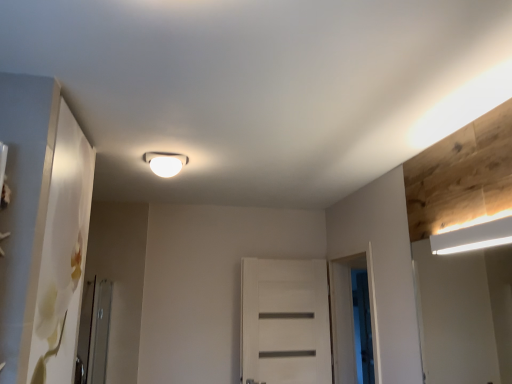
Question: Is clear glass screen door at lower left, the first screen door positioned from the front, spatially inside white matte rectangular light fixture at upper right, positioned as the second lamp in back-to-front order, or outside of it?

Choices:
 (A) inside
 (B) outside

Answer: (B)

Question: Is clear glass screen door at lower left, placed as the first screen door when sorted from left to right, taller or shorter than white matte rectangular light fixture at upper right, which appears as the second lamp when viewed from the left?

Choices:
 (A) short
 (B) tall

Answer: (B)

Question: Which is farther from the clear glass screen door at lower left, placed as the first screen door when sorted from left to right?

Choices:
 (A) white glossy light fixture at center, which appears as the 2th lamp when viewed from the right
 (B) transparent glass screen door at center-right, the third screen door viewed from the left
 (C) white matte screen door at center, the second screen door in the front-to-back sequence
 (D) white matte rectangular light fixture at upper right, which is the first lamp in right-to-left order
 (E) white matte door at center

Answer: (D)

Question: Considering the real-world distances, which object is farthest from the transparent glass screen door at center-right, positioned as the 1th screen door in back-to-front order?

Choices:
 (A) white glossy light fixture at center, which appears as the 2th lamp when viewed from the right
 (B) white matte door at center
 (C) clear glass screen door at lower left, the first screen door positioned from the front
 (D) white matte rectangular light fixture at upper right, the 1th lamp from the front
 (E) white matte screen door at center, the second screen door in the front-to-back sequence

Answer: (C)